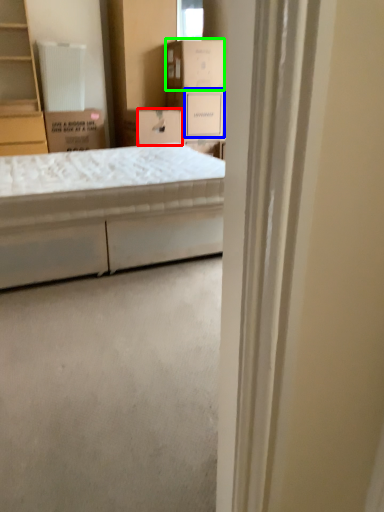
Question: Estimate the real-world distances between objects in this image. Which object is farther from storage box (highlighted by a red box), storage box (highlighted by a blue box) or cardboard box (highlighted by a green box)?

Choices:
 (A) storage box
 (B) cardboard box

Answer: (B)